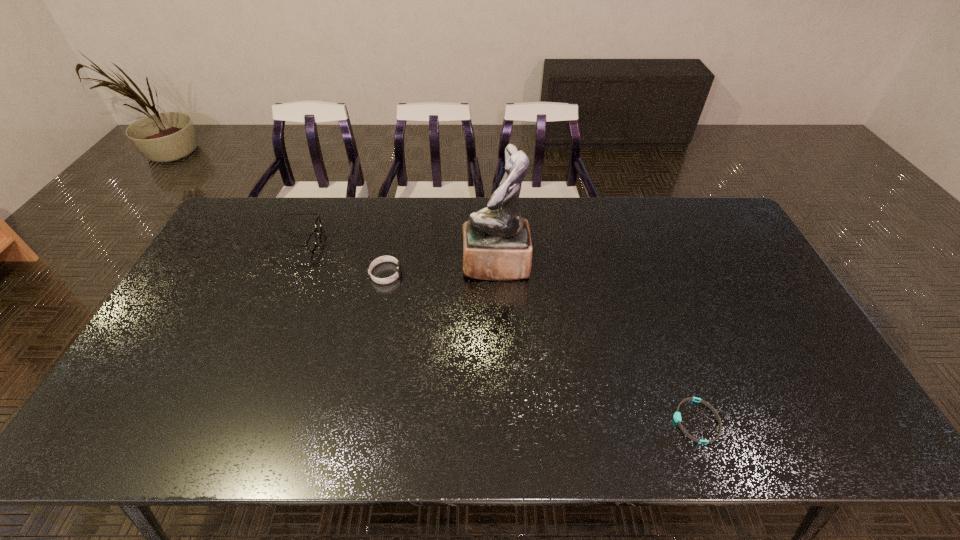
Find the location of a particular element. The image size is (960, 540). vacant space at the right edge is located at coordinates (735, 297).

In the image, there is a desktop. Where is `free space at the far left corner`? The image size is (960, 540). free space at the far left corner is located at coordinates (269, 197).

In order to click on free spot at the near right corner of the desktop in this screenshot , I will do `click(825, 436)`.

Find the location of `vacant point located between the second object from left to right and the spectacles`. vacant point located between the second object from left to right and the spectacles is located at coordinates (341, 257).

The height and width of the screenshot is (540, 960). Identify the location of vacant area that lies between the right wristband and the spectacles. (496, 330).

Locate an element on the screen. Image resolution: width=960 pixels, height=540 pixels. free space between the farther wristband and the shorter wristband is located at coordinates (540, 347).

The height and width of the screenshot is (540, 960). Identify the location of vacant region between the sculpture and the spectacles. point(396,252).

I want to click on free area in between the third object from right to left and the spectacles, so click(x=341, y=257).

The height and width of the screenshot is (540, 960). What are the coordinates of `free space between the second object from right to left and the shortest object` in the screenshot? It's located at (596, 342).

This screenshot has width=960, height=540. I want to click on empty space that is in between the farther wristband and the spectacles, so click(341, 257).